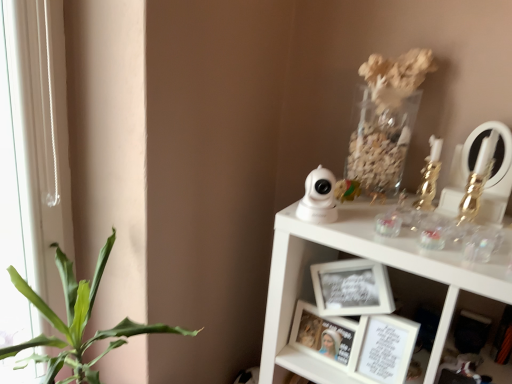
Question: From a real-world perspective, is matte white picture frame at center, the 1th picture frame from the left, above or below green leafy plant at left?

Choices:
 (A) below
 (B) above

Answer: (B)

Question: Based on their positions, is matte white picture frame at center, the 1th picture frame from the left, located to the left or right of green leafy plant at left?

Choices:
 (A) left
 (B) right

Answer: (B)

Question: Estimate the real-world distances between objects in this image. Which object is farther from the matte white picture frame at center, the 1th picture frame from the left?

Choices:
 (A) white matte picture frame at lower center, placed as the second picture frame when sorted from left to right
 (B) gold metallic candlestick at upper right, which ranks as the first toy in right-to-left order
 (C) green leafy plant at left
 (D) gold metallic candle holder at upper right
 (E) white glossy security camera at upper right, arranged as the 1th toy when viewed from the left

Answer: (C)

Question: Which is farther from the green leafy plant at left?

Choices:
 (A) white matte picture frame at lower center, placed as the second picture frame when sorted from left to right
 (B) gold metallic candlestick at upper right, which ranks as the first toy in right-to-left order
 (C) matte white picture frame at center, the 2th picture frame in the right-to-left sequence
 (D) white glossy security camera at upper right, which is counted as the second toy, starting from the right
 (E) gold metallic candle holder at upper right

Answer: (B)